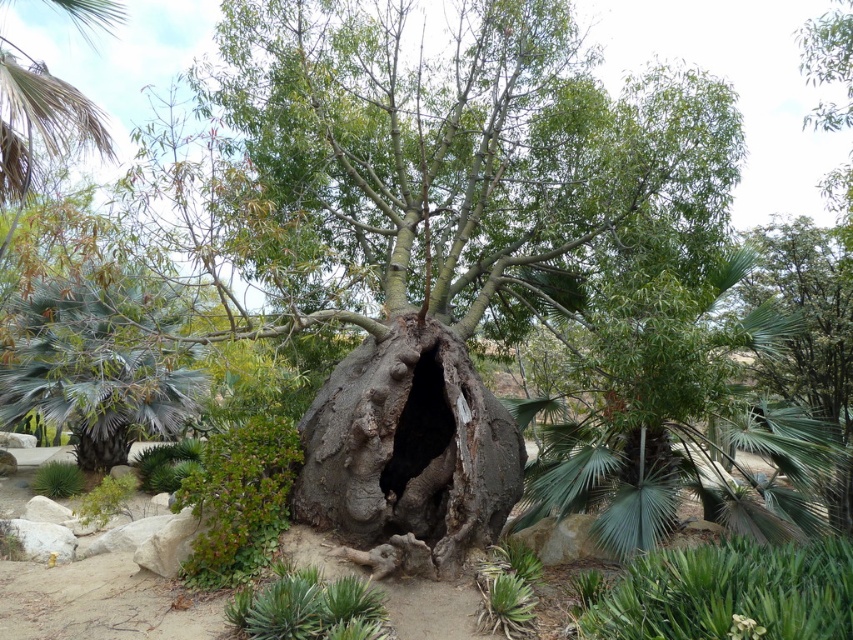
Can you confirm if green leafy palm at upper center is bigger than rough bark tree trunk at center?

Yes, green leafy palm at upper center is bigger than rough bark tree trunk at center.

Who is shorter, green leafy palm at upper center or rough bark tree trunk at center?

rough bark tree trunk at center

You are a GUI agent. You are given a task and a screenshot of the screen. Output one action in this format:
    pyautogui.click(x=<x>, y=<y>)
    Task: Click on the green leafy palm at upper center
    This screenshot has height=640, width=853.
    Given the screenshot: What is the action you would take?
    pyautogui.click(x=674, y=424)

Is green leafy palm at upper center above green succulent at lower right?

Indeed, green leafy palm at upper center is positioned over green succulent at lower right.

Who is higher up, green leafy palm at upper center or green succulent at lower right?

green leafy palm at upper center is higher up.

Where is `green leafy palm at upper center`? green leafy palm at upper center is located at coordinates (674, 424).

Is rough bark tree trunk at center below green succulent at lower right?

No.

Can you confirm if rough bark tree trunk at center is bigger than green succulent at lower right?

Correct, rough bark tree trunk at center is larger in size than green succulent at lower right.

Between point (363, 506) and point (775, 627), which one is positioned behind?

The point (363, 506) is more distant.

In order to click on rough bark tree trunk at center in this screenshot , I will do `click(409, 445)`.